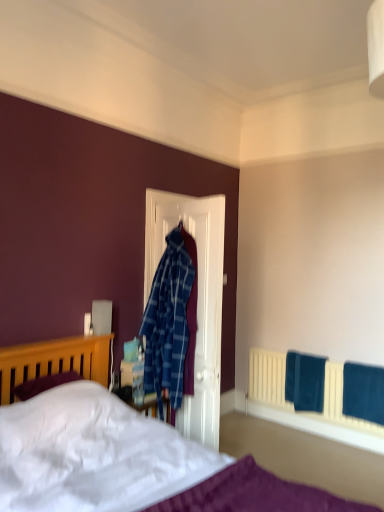
Question: Is teal fabric towel at lower right, positioned as the 2th bath towel in front-to-back order, at the right side of white soft bed at lower left?

Choices:
 (A) yes
 (B) no

Answer: (A)

Question: Does teal fabric towel at lower right, marked as the first bath towel in a left-to-right arrangement, have a greater width compared to white soft bed at lower left?

Choices:
 (A) yes
 (B) no

Answer: (B)

Question: Is teal fabric towel at lower right, marked as the 1th bath towel in a back-to-front arrangement, further to camera compared to white soft bed at lower left?

Choices:
 (A) no
 (B) yes

Answer: (B)

Question: Is teal fabric towel at lower right, positioned as the 2th bath towel in front-to-back order, placed right next to white soft bed at lower left?

Choices:
 (A) no
 (B) yes

Answer: (A)

Question: From the image's perspective, does teal fabric towel at lower right, the second bath towel in the right-to-left sequence, appear lower than white soft bed at lower left?

Choices:
 (A) yes
 (B) no

Answer: (A)

Question: Can we say teal fabric towel at lower right, positioned as the 2th bath towel in front-to-back order, lies outside white soft bed at lower left?

Choices:
 (A) yes
 (B) no

Answer: (A)

Question: Can you confirm if white soft bed at lower left is wider than velvet blue bath towel at lower right, which is the first bath towel from right to left?

Choices:
 (A) no
 (B) yes

Answer: (B)

Question: Can you confirm if white soft bed at lower left is shorter than velvet blue bath towel at lower right, which is the 1th bath towel in front-to-back order?

Choices:
 (A) yes
 (B) no

Answer: (B)

Question: Does white soft bed at lower left appear on the right side of velvet blue bath towel at lower right, which is the 1th bath towel in front-to-back order?

Choices:
 (A) yes
 (B) no

Answer: (B)

Question: From a real-world perspective, is white soft bed at lower left beneath velvet blue bath towel at lower right, which is the 1th bath towel in front-to-back order?

Choices:
 (A) no
 (B) yes

Answer: (A)

Question: Could you tell me if white soft bed at lower left is facing velvet blue bath towel at lower right, which is the 1th bath towel in front-to-back order?

Choices:
 (A) yes
 (B) no

Answer: (B)

Question: Is white soft bed at lower left not close to velvet blue bath towel at lower right, the second bath towel positioned from the back?

Choices:
 (A) yes
 (B) no

Answer: (B)

Question: Is teal fabric towel at lower right, the second bath towel in the right-to-left sequence, thinner than velvet blue bath towel at lower right, the second bath towel positioned from the back?

Choices:
 (A) yes
 (B) no

Answer: (A)